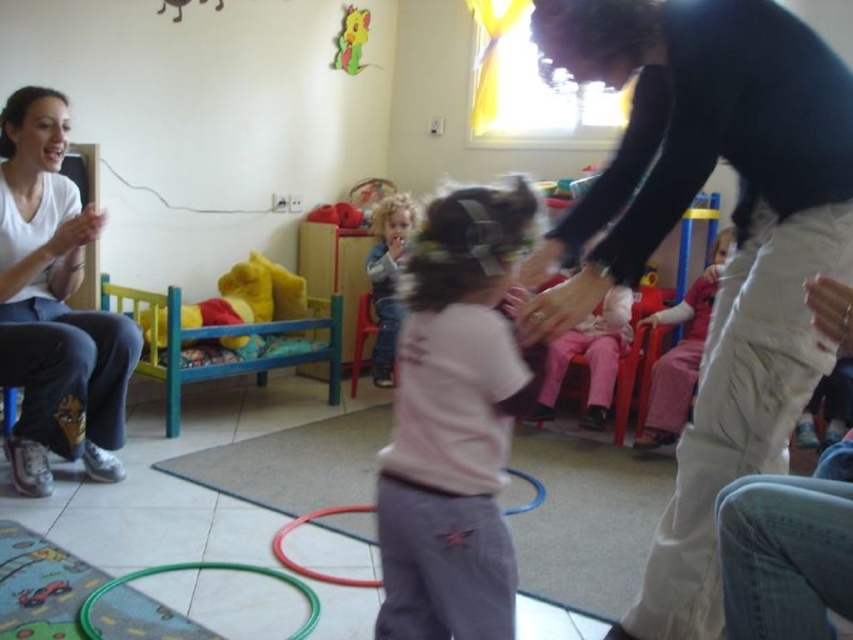
Can you confirm if matte pink pants at center is positioned above matte yellow paper mouse at upper center?

No.

Is point (715, 257) farther from viewer compared to point (335, 58)?

No, it is not.

This screenshot has width=853, height=640. Describe the element at coordinates (680, 353) in the screenshot. I see `matte pink pants at center` at that location.

Find the location of a particular element. The width and height of the screenshot is (853, 640). matte pink pants at center is located at coordinates (680, 353).

This screenshot has height=640, width=853. What are the coordinates of `green plastic hoop at lower center` in the screenshot? It's located at (200, 570).

Can you confirm if green plastic hoop at lower center is positioned above matte yellow paper mouse at upper center?

No, green plastic hoop at lower center is not above matte yellow paper mouse at upper center.

Which is in front, point (148, 573) or point (352, 19)?

Positioned in front is point (148, 573).

Find the location of a particular element. This screenshot has height=640, width=853. green plastic hoop at lower center is located at coordinates (200, 570).

Is matte yellow paper mouse at upper center positioned at the back of blue plastic hoop at center?

That is True.

Is matte yellow paper mouse at upper center wider than blue plastic hoop at center?

Yes.

Where is `matte yellow paper mouse at upper center`? The image size is (853, 640). matte yellow paper mouse at upper center is located at coordinates point(351,40).